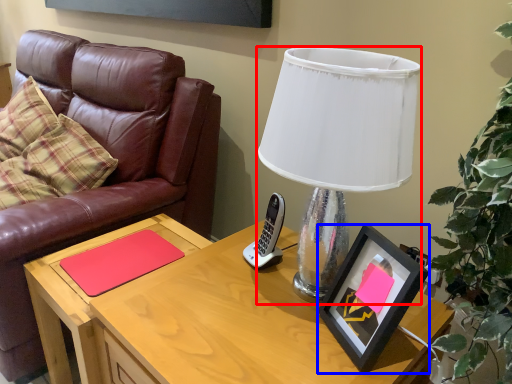
Question: Which object is further to the camera taking this photo, lamp (highlighted by a red box) or picture frame (highlighted by a blue box)?

Choices:
 (A) lamp
 (B) picture frame

Answer: (B)